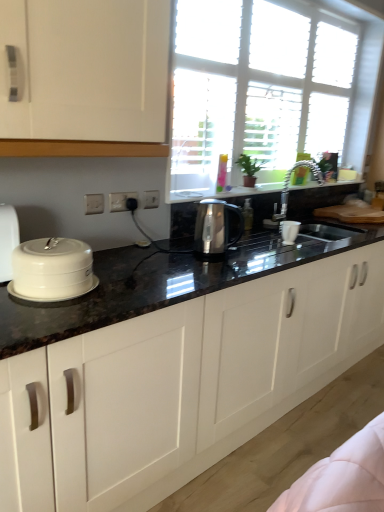
Where is `vacant region to the right of white ceramic lid at left`? The image size is (384, 512). vacant region to the right of white ceramic lid at left is located at coordinates (130, 298).